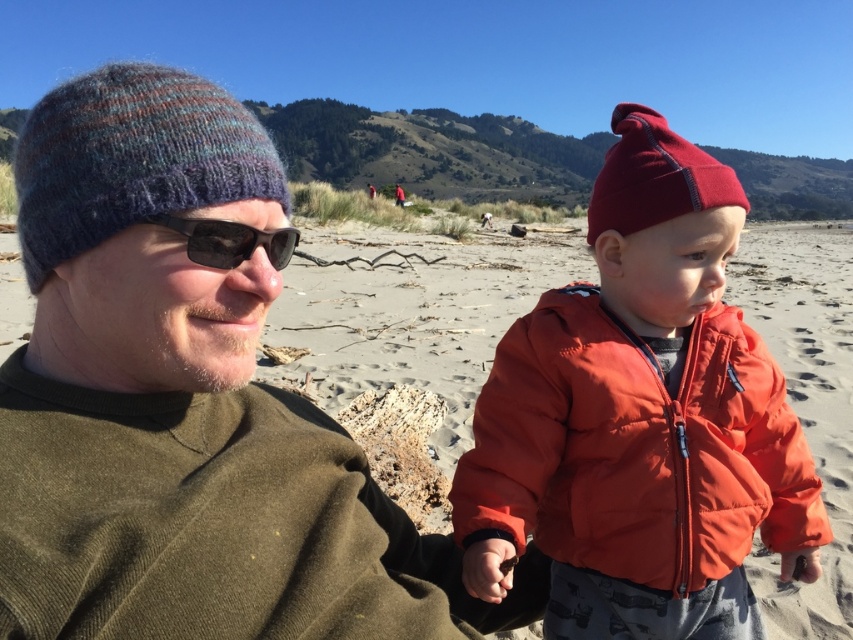
Is matte red beanie at right below knitted woolen beanie at left?

Indeed, matte red beanie at right is positioned under knitted woolen beanie at left.

What do you see at coordinates (640, 419) in the screenshot? This screenshot has height=640, width=853. I see `matte red beanie at right` at bounding box center [640, 419].

Locate an element on the screen. matte red beanie at right is located at coordinates (640, 419).

Is knitted wool hat at left to the left of knitted woolen beanie at left from the viewer's perspective?

Incorrect, knitted wool hat at left is not on the left side of knitted woolen beanie at left.

What do you see at coordinates (184, 404) in the screenshot?
I see `knitted wool hat at left` at bounding box center [184, 404].

I want to click on knitted wool hat at left, so click(184, 404).

Does matte red beanie at right appear over sunglasses at left?

Actually, matte red beanie at right is below sunglasses at left.

How distant is matte red beanie at right from sunglasses at left?

matte red beanie at right and sunglasses at left are 32.41 inches apart from each other.

Is point (639, 627) positioned before point (183, 232)?

No, (639, 627) is further to viewer.

You are a GUI agent. You are given a task and a screenshot of the screen. Output one action in this format:
    pyautogui.click(x=<x>, y=<y>)
    Task: Click on the matte red beanie at right
    This screenshot has height=640, width=853.
    Given the screenshot: What is the action you would take?
    pyautogui.click(x=640, y=419)